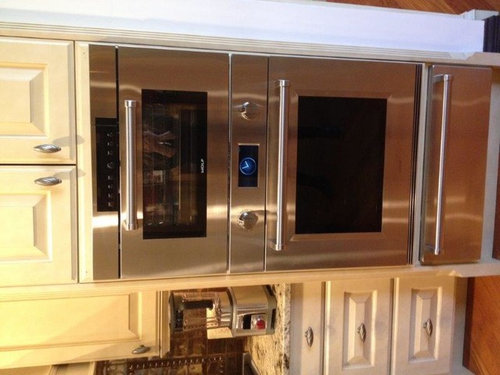
Where is `wall`? This screenshot has height=375, width=500. wall is located at coordinates (x=451, y=41), (x=208, y=16), (x=77, y=14).